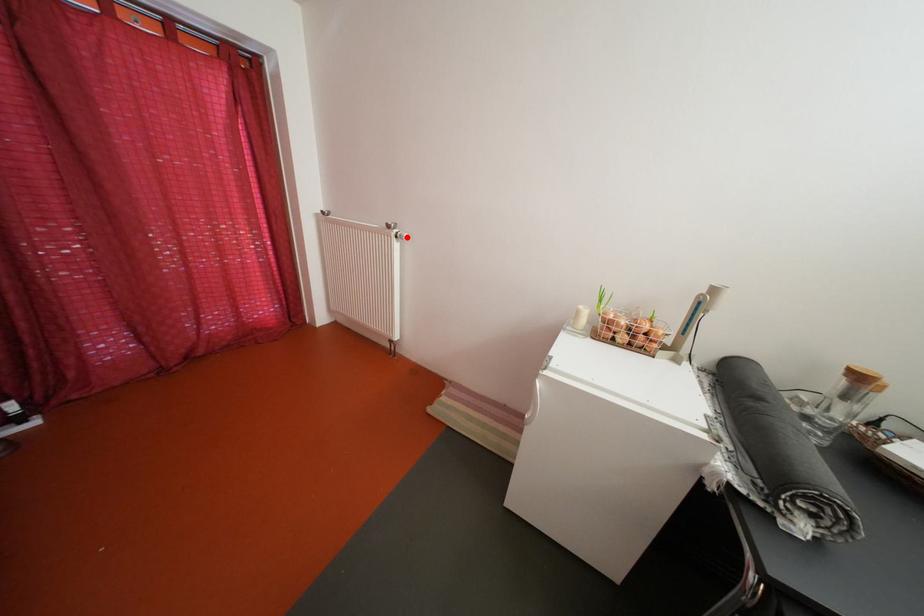
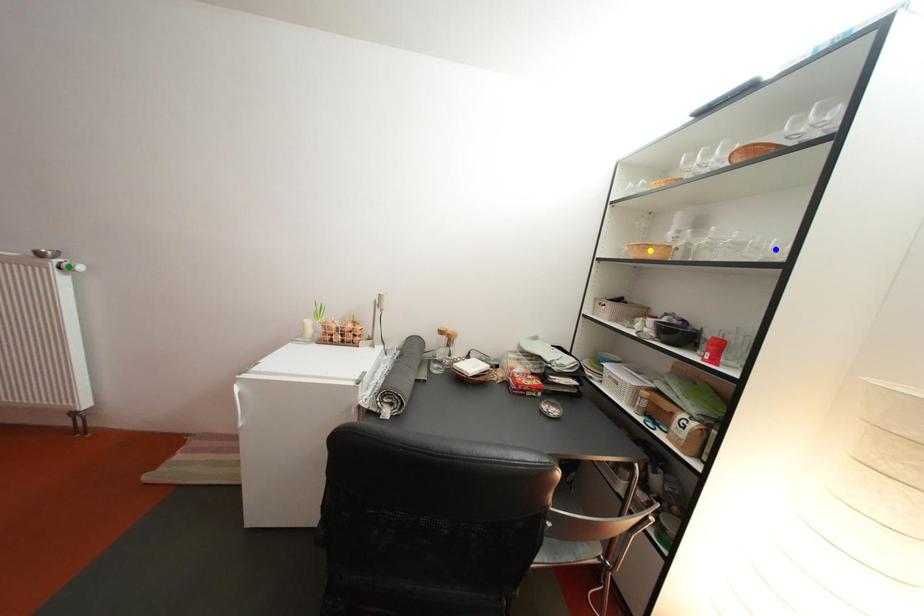
Question: I am providing you with two images of the same scene from different viewpoints. A red point is marked on the first image. You are given multiple points on the second image. In image 2, which mark is for the same physical point as the one in image 1?

Choices:
 (A) green point
 (B) yellow point
 (C) blue point

Answer: (A)